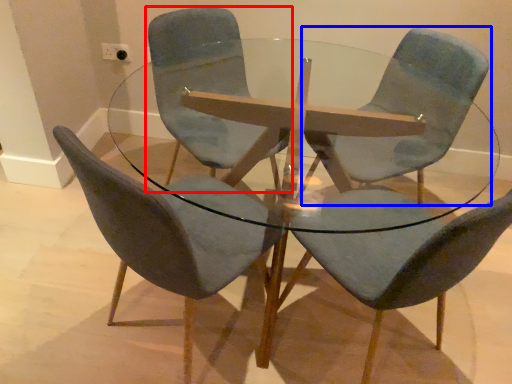
Question: Which object is further to the camera taking this photo, chair (highlighted by a red box) or chair (highlighted by a blue box)?

Choices:
 (A) chair
 (B) chair

Answer: (B)